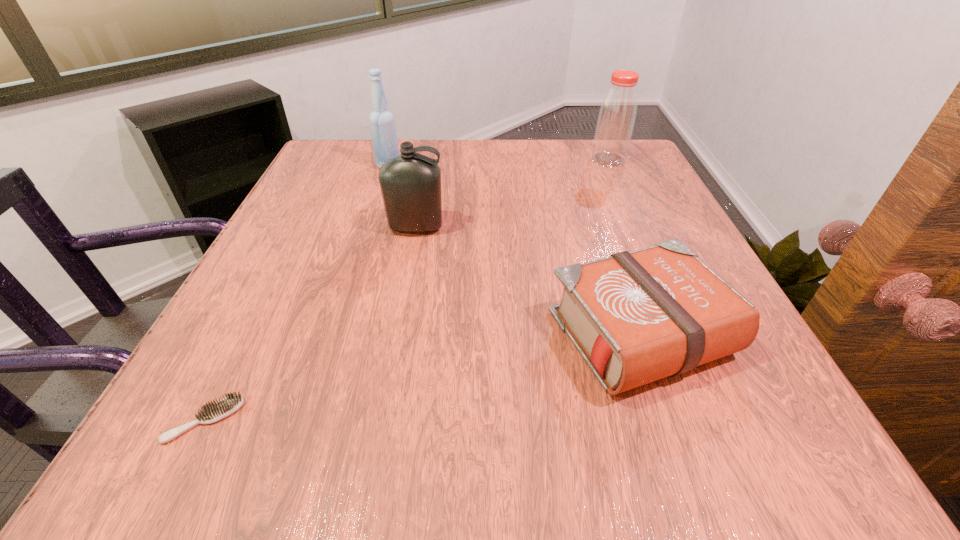
Locate an element on the screen. The width and height of the screenshot is (960, 540). vacant space that satisfies the following two spatial constraints: 1. on the back side of the second bottle from right to left; 2. on the right side of the shortest object is located at coordinates (302, 227).

You are a GUI agent. You are given a task and a screenshot of the screen. Output one action in this format:
    pyautogui.click(x=<x>, y=<y>)
    Task: Click on the vacant area in the image that satisfies the following two spatial constraints: 1. on the back side of the shortest object; 2. on the right side of the rightmost bottle
    The width and height of the screenshot is (960, 540).
    Given the screenshot: What is the action you would take?
    pyautogui.click(x=337, y=160)